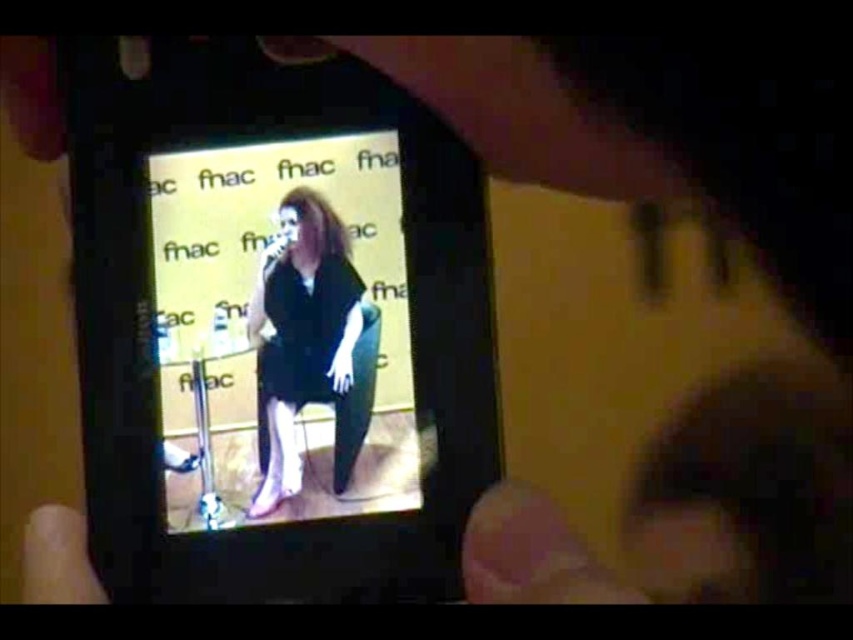
You are a photographer trying to capture a candid shot of the performer in the video displayed on the smartphone. Considering the positioning of the matte black dress at center and the smooth skin hand at lower left, which object is closer to the camera lens?

The smooth skin hand at lower left is closer to the camera lens because the matte black dress at center is above it, indicating it is further away in the depth of field.

From the picture: You are standing in the room where the image was taken. You see two points in the scene, one at point coordinates point [364,428] and the other at point coordinates point [27,557]. Which point is closer to you?

Point [364,428] is further to the viewer than point [27,557], so the closer point to you is point [27,557].